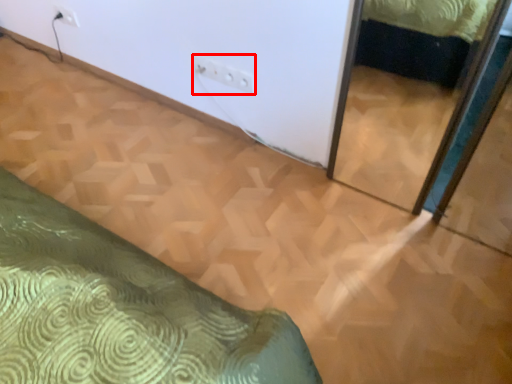
Question: From the image's perspective, where is electric outlet (annotated by the red box) located in relation to electric outlet in the image?

Choices:
 (A) below
 (B) above

Answer: (A)